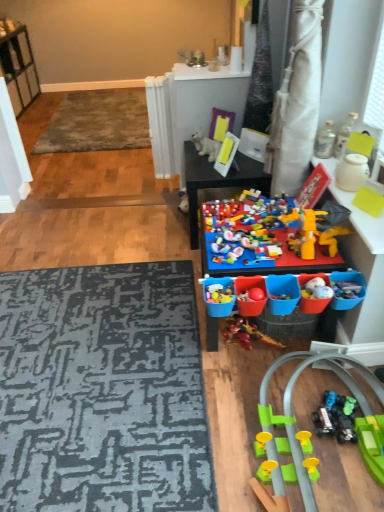
Locate an element on the screen. This screenshot has height=512, width=384. yellow plastic figure at center, placed as the 5th toy when sorted from top to bottom is located at coordinates (317, 229).

In the scene shown: What is the approximate height of translucent glass bottle at upper right, the sixth toy in the bottom-to-top sequence?

8.54 inches.

Locate an element on the screen. white plastic radiator at upper center is located at coordinates (160, 124).

This screenshot has height=512, width=384. What do you see at coordinates (160, 124) in the screenshot?
I see `white plastic radiator at upper center` at bounding box center [160, 124].

Describe the element at coordinates (97, 122) in the screenshot. I see `textured gray rug at upper left, positioned as the first mat in back-to-front order` at that location.

Locate an element on the screen. The height and width of the screenshot is (512, 384). yellow plastic figure at center, placed as the 5th toy when sorted from top to bottom is located at coordinates (317, 229).

You are a GUI agent. You are given a task and a screenshot of the screen. Output one action in this format:
    pyautogui.click(x=<x>, y=<y>)
    Task: Click on the radiator that is on the left side of bright plastic lego set at center, arranged as the fourth toy when ordered from the bottom
    The height and width of the screenshot is (512, 384).
    Given the screenshot: What is the action you would take?
    pyautogui.click(x=160, y=124)

Between bright plastic lego set at center, which is counted as the fourth toy, starting from the top, and white plastic radiator at upper center, which one has more height?

white plastic radiator at upper center is taller.

Does bright plastic lego set at center, arranged as the fourth toy when ordered from the bottom, touch white plastic radiator at upper center?

bright plastic lego set at center, arranged as the fourth toy when ordered from the bottom, is not next to white plastic radiator at upper center, and they're not touching.

Between bright plastic lego set at center, which is counted as the fourth toy, starting from the top, and white plastic radiator at upper center, which one has smaller width?

white plastic radiator at upper center is thinner.

From the image's perspective, is multicolored plastic toy at center, the 2th toy positioned from the bottom, above or below rubberized green track at lower right, which is counted as the first toy, starting from the bottom?

multicolored plastic toy at center, the 2th toy positioned from the bottom, is situated higher than rubberized green track at lower right, which is counted as the first toy, starting from the bottom, in the image.

Who is shorter, multicolored plastic toy at center, the sixth toy positioned from the top, or rubberized green track at lower right, which is counted as the first toy, starting from the bottom?

rubberized green track at lower right, which is counted as the first toy, starting from the bottom, is shorter.

Is multicolored plastic toy at center, the sixth toy positioned from the top, located outside rubberized green track at lower right, which ranks as the seventh toy in top-to-bottom order?

Absolutely, multicolored plastic toy at center, the sixth toy positioned from the top, is external to rubberized green track at lower right, which ranks as the seventh toy in top-to-bottom order.

Which object is closer to the camera taking this photo, multicolored plastic toy at center, the sixth toy positioned from the top, or rubberized green track at lower right, which is counted as the first toy, starting from the bottom?

rubberized green track at lower right, which is counted as the first toy, starting from the bottom, is in front.

From the image's perspective, is yellow plastic figure at center, the 3th toy in the bottom-to-top sequence, positioned above or below multicolored plastic toy at center?

Based on their image positions, yellow plastic figure at center, the 3th toy in the bottom-to-top sequence, is located beneath multicolored plastic toy at center.

Is yellow plastic figure at center, placed as the 5th toy when sorted from top to bottom, inside or outside of multicolored plastic toy at center?

yellow plastic figure at center, placed as the 5th toy when sorted from top to bottom, is not enclosed by multicolored plastic toy at center.

From a real-world perspective, is yellow plastic figure at center, placed as the 5th toy when sorted from top to bottom, positioned under multicolored plastic toy at center based on gravity?

No, from a real-world perspective, yellow plastic figure at center, placed as the 5th toy when sorted from top to bottom, is not below multicolored plastic toy at center.

Can you confirm if translucent glass bottle at upper right, which is the 2th toy in top-to-bottom order, is wider than yellow plastic figure at center, the 3th toy in the bottom-to-top sequence?

No.

Does point (349, 118) lie behind point (314, 244)?

Yes, it is.

Considering the positions of objects translucent glass bottle at upper right, which is the 2th toy in top-to-bottom order, and yellow plastic figure at center, placed as the 5th toy when sorted from top to bottom, in the image provided, who is behind, translucent glass bottle at upper right, which is the 2th toy in top-to-bottom order, or yellow plastic figure at center, placed as the 5th toy when sorted from top to bottom,?

translucent glass bottle at upper right, which is the 2th toy in top-to-bottom order, is more distant.

From the picture: From a real-world perspective, is translucent glass bottle at upper right, the sixth toy in the bottom-to-top sequence, located higher than yellow plastic figure at center, the 3th toy in the bottom-to-top sequence?

Yes.

Can you see multicolored plastic toy at center touching metallic glass bottle at upper right, the 5th toy ordered from the bottom?

No, multicolored plastic toy at center is not next to metallic glass bottle at upper right, the 5th toy ordered from the bottom.

Consider the image. Does multicolored plastic toy at center have a lesser width compared to metallic glass bottle at upper right, the 5th toy ordered from the bottom?

In fact, multicolored plastic toy at center might be wider than metallic glass bottle at upper right, the 5th toy ordered from the bottom.

Which object is further away from the camera taking this photo, multicolored plastic toy at center or metallic glass bottle at upper right, the 5th toy ordered from the bottom?

multicolored plastic toy at center is further from the camera.

Can you confirm if multicolored plastic toy at center is taller than metallic glass bottle at upper right, the 5th toy ordered from the bottom?

Indeed, multicolored plastic toy at center has a greater height compared to metallic glass bottle at upper right, the 5th toy ordered from the bottom.

The width and height of the screenshot is (384, 512). In order to click on the 7th toy below when counting from the white plastic shelf at upper left (from the image's perspective) in this screenshot , I will do `click(296, 429)`.

Who is shorter, rubberized green track at lower right, which ranks as the seventh toy in top-to-bottom order, or white plastic shelf at upper left?

rubberized green track at lower right, which ranks as the seventh toy in top-to-bottom order.

Which is in front, rubberized green track at lower right, which ranks as the seventh toy in top-to-bottom order, or white plastic shelf at upper left?

rubberized green track at lower right, which ranks as the seventh toy in top-to-bottom order.

Is rubberized green track at lower right, which ranks as the seventh toy in top-to-bottom order, bigger than white plastic radiator at upper center?

Correct, rubberized green track at lower right, which ranks as the seventh toy in top-to-bottom order, is larger in size than white plastic radiator at upper center.

Consider the image. From the image's perspective, is rubberized green track at lower right, which is counted as the first toy, starting from the bottom, located above white plastic radiator at upper center?

Answer: Actually, rubberized green track at lower right, which is counted as the first toy, starting from the bottom, appears below white plastic radiator at upper center in the image.

In the scene shown: Is the depth of rubberized green track at lower right, which ranks as the seventh toy in top-to-bottom order, greater than that of white plastic radiator at upper center?

No, it is in front of white plastic radiator at upper center.

Is rubberized green track at lower right, which ranks as the seventh toy in top-to-bottom order, oriented away from white plastic radiator at upper center?

No, rubberized green track at lower right, which ranks as the seventh toy in top-to-bottom order,'s orientation is not away from white plastic radiator at upper center.

Starting from the white plastic radiator at upper center, which toy is the 2nd one to the right? Please provide its 2D coordinates.

[(269, 233)]

Where is `the 2nd toy counting from the left side of the rubberized green track at lower right, which ranks as the seventh toy in top-to-bottom order`? The width and height of the screenshot is (384, 512). the 2nd toy counting from the left side of the rubberized green track at lower right, which ranks as the seventh toy in top-to-bottom order is located at coordinates (255, 239).

Looking at the image, which one is located further to textured gray rug at upper left, the 2th mat positioned from the front, multicolored plastic toy at center, the sixth toy positioned from the top, or textured gray rug at lower left, arranged as the 1th mat when ordered from the bottom?

multicolored plastic toy at center, the sixth toy positioned from the top, lies further to textured gray rug at upper left, the 2th mat positioned from the front, than the other object.

Which object lies further to the anchor point translucent glass bottle at upper right, which is the 2th toy in top-to-bottom order, yellow plastic figure at center, the 3th toy in the bottom-to-top sequence, or white plastic dog at center, which appears as the first toy when viewed from the top?

Among the two, white plastic dog at center, which appears as the first toy when viewed from the top, is located further to translucent glass bottle at upper right, which is the 2th toy in top-to-bottom order.

Looking at the image, which one is located closer to bright plastic lego set at center, which is counted as the fourth toy, starting from the top, white plastic radiator at upper center or white plastic shelf at upper left?

Among the two, white plastic radiator at upper center is located nearer to bright plastic lego set at center, which is counted as the fourth toy, starting from the top.

Based on their spatial positions, is white plastic shelf at upper left or metallic glass bottle at upper right, the third toy in the top-to-bottom sequence, further from textured gray rug at upper left, the 1th mat viewed from the top?

metallic glass bottle at upper right, the third toy in the top-to-bottom sequence.

From the image, which object appears to be farther from white plastic dog at center, which appears as the first toy when viewed from the top, translucent glass bottle at upper right, which is the 2th toy in top-to-bottom order, or bright plastic lego set at center, which is counted as the fourth toy, starting from the top?

Among the two, translucent glass bottle at upper right, which is the 2th toy in top-to-bottom order, is located further to white plastic dog at center, which appears as the first toy when viewed from the top.

When comparing their distances from textured gray rug at upper left, positioned as the first mat in back-to-front order, does rubberized green track at lower right, which ranks as the seventh toy in top-to-bottom order, or yellow plastic figure at center, placed as the 5th toy when sorted from top to bottom, seem further?

rubberized green track at lower right, which ranks as the seventh toy in top-to-bottom order, lies further to textured gray rug at upper left, positioned as the first mat in back-to-front order, than the other object.

Based on their spatial positions, is textured gray rug at upper left, the 2th mat in the bottom-to-top sequence, or translucent glass bottle at upper right, which is the 2th toy in top-to-bottom order, closer to bright plastic lego set at center, which is counted as the fourth toy, starting from the top?

The object closer to bright plastic lego set at center, which is counted as the fourth toy, starting from the top, is translucent glass bottle at upper right, which is the 2th toy in top-to-bottom order.

When comparing their distances from white plastic shelf at upper left, does white plastic radiator at upper center or textured gray rug at lower left, which is the second mat in top-to-bottom order, seem closer?

The object closer to white plastic shelf at upper left is white plastic radiator at upper center.

You are a GUI agent. You are given a task and a screenshot of the screen. Output one action in this format:
    pyautogui.click(x=<x>, y=<y>)
    Task: Click on the radiator between white plastic dog at center, placed as the 7th toy when sorted from bottom to top, and textured gray rug at upper left, positioned as the first mat in back-to-front order, from front to back
    The height and width of the screenshot is (512, 384).
    Given the screenshot: What is the action you would take?
    pyautogui.click(x=160, y=124)

Find the location of a particular element. The image size is (384, 512). table located between textured gray rug at lower left, the 1th mat viewed from the front, and yellow plastic figure at center, the 3th toy in the bottom-to-top sequence, in the left-right direction is located at coordinates (217, 180).

I want to click on table between white plastic radiator at upper center and metallic glass bottle at upper right, the 5th toy ordered from the bottom, from left to right, so click(217, 180).

I want to click on radiator positioned between textured gray rug at lower left, arranged as the 1th mat when ordered from the bottom, and textured gray rug at upper left, positioned as the first mat in back-to-front order, from near to far, so click(x=160, y=124).